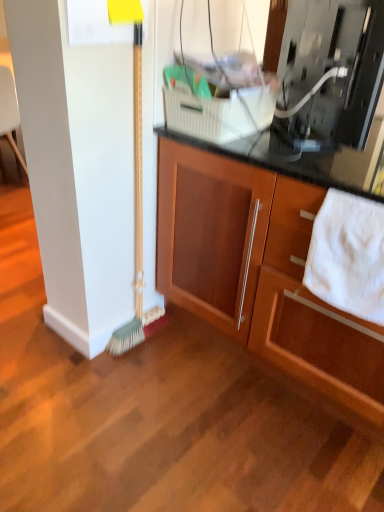
Question: Is point (304, 128) positioned closer to the camera than point (140, 54)?

Choices:
 (A) closer
 (B) farther

Answer: (B)

Question: Looking at their shapes, would you say metallic silver microwave at upper right is wider or thinner than green bristle broom at left?

Choices:
 (A) wide
 (B) thin

Answer: (A)

Question: Considering the real-world distances, which object is closest to the wooden cabinet at center?

Choices:
 (A) green bristle broom at left
 (B) white soft towel at lower right
 (C) metallic silver microwave at upper right

Answer: (B)

Question: Based on their relative distances, which object is farther from the green bristle broom at left?

Choices:
 (A) wooden cabinet at center
 (B) white soft towel at lower right
 (C) metallic silver microwave at upper right

Answer: (B)